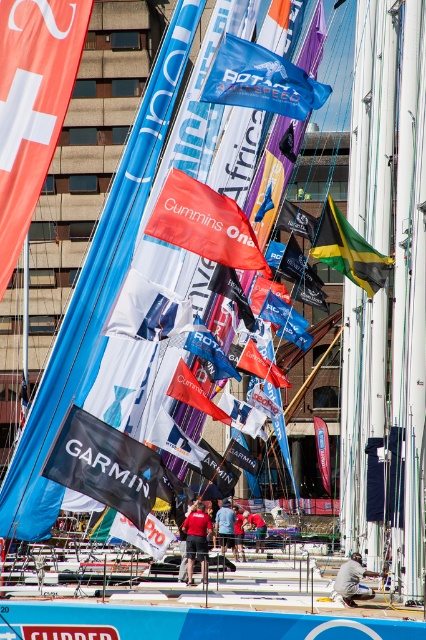
Question: Can you confirm if blue fabric flag at center is bigger than white matte flag at center?

Choices:
 (A) no
 (B) yes

Answer: (B)

Question: Is red matte flag at center positioned in front of blue fabric flag at center?

Choices:
 (A) no
 (B) yes

Answer: (B)

Question: Can you confirm if white matte flag at center is positioned to the right of white/textured fabric flag at center?

Choices:
 (A) no
 (B) yes

Answer: (B)

Question: Which point appears closest to the camera in this image?

Choices:
 (A) (244, 88)
 (B) (161, 556)
 (C) (109, 436)
 (D) (161, 224)

Answer: (C)

Question: Which object is positioned farthest from the red fabric flag at center?

Choices:
 (A) white/textured fabric flag at center
 (B) white matte flag at center

Answer: (B)

Question: Which object appears closest to the camera in this image?

Choices:
 (A) white matte flag at center
 (B) black fabric flag at center
 (C) white/textured fabric flag at center

Answer: (B)